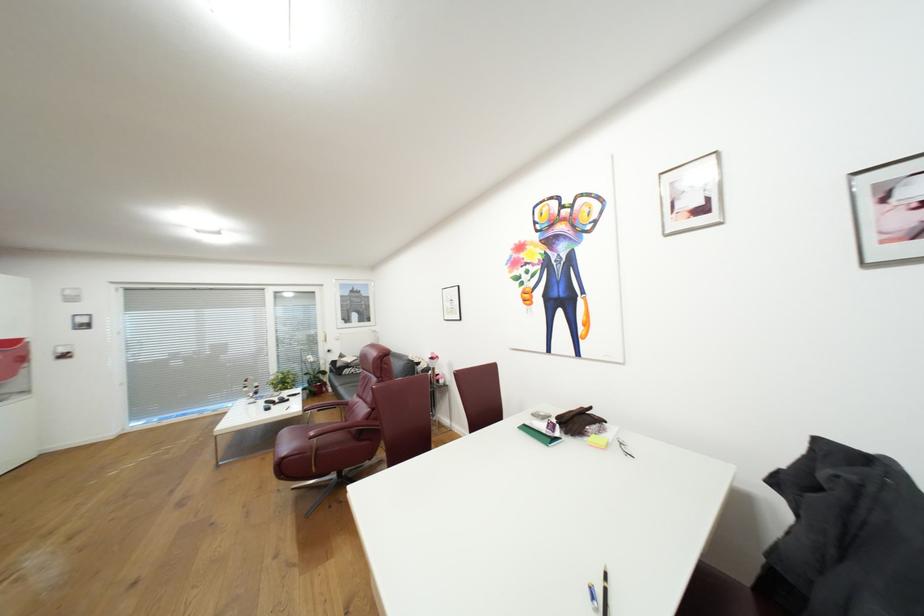
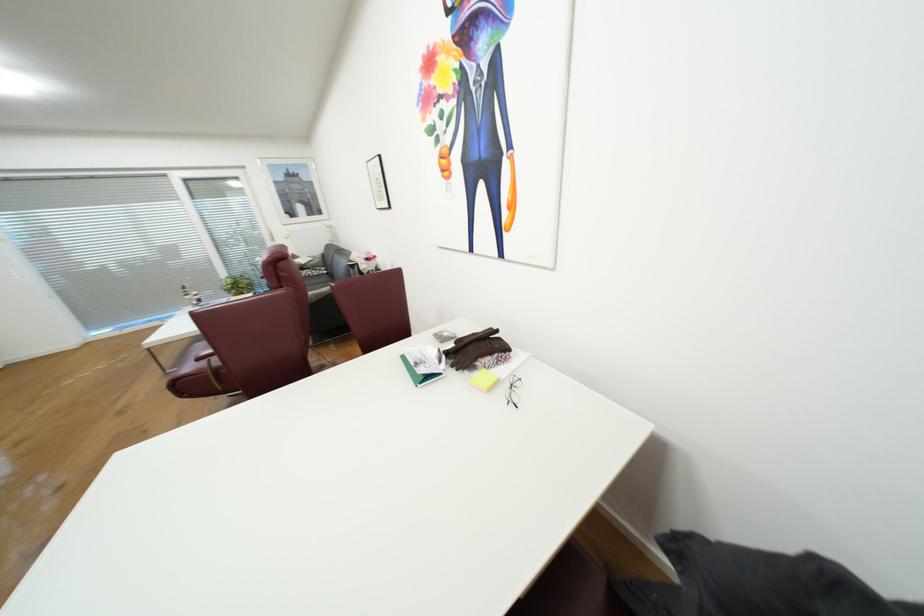
Question: I am providing you with two images of the same scene from different viewpoints. Which of the following objects are not visible in image2?

Choices:
 (A) sofa armrest
 (B) brown leather gloves
 (C) red chair armrest
 (D) none of these

Answer: (D)